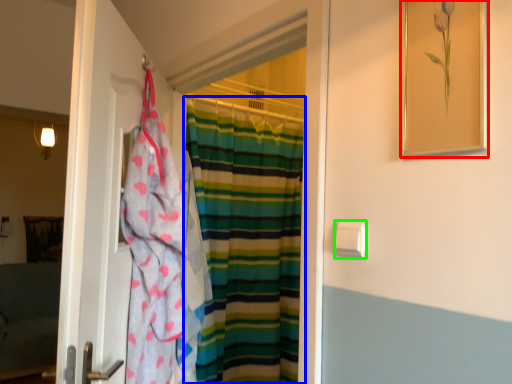
Question: Estimate the real-world distances between objects in this image. Which object is farther from picture frame (highlighted by a red box), curtain (highlighted by a blue box) or towel bar (highlighted by a green box)?

Choices:
 (A) curtain
 (B) towel bar

Answer: (A)